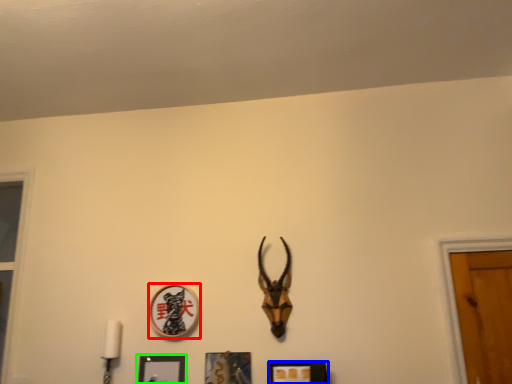
Question: Estimate the real-world distances between objects in this image. Which object is closer to picture frame (highlighted by a red box), picture frame (highlighted by a blue box) or picture frame (highlighted by a green box)?

Choices:
 (A) picture frame
 (B) picture frame

Answer: (B)